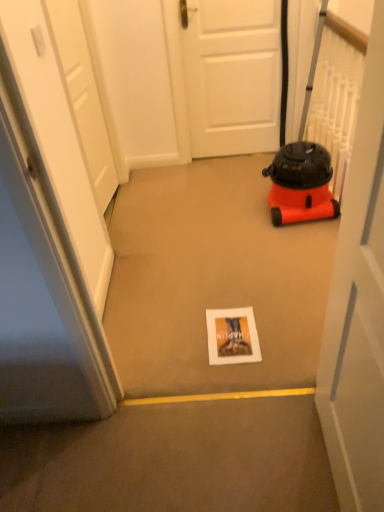
Question: Is white matte door at center, marked as the 3th door in a front-to-back arrangement, located outside white matte door at center, the third door viewed from the left?

Choices:
 (A) no
 (B) yes

Answer: (B)

Question: Is the surface of white matte door at center, the first door in the back-to-front sequence, in direct contact with white matte door at center, marked as the third door in a back-to-front arrangement?

Choices:
 (A) no
 (B) yes

Answer: (A)

Question: Can you confirm if white matte door at center, marked as the 3th door in a front-to-back arrangement, is thinner than white matte door at center, the first door viewed from the front?

Choices:
 (A) yes
 (B) no

Answer: (A)

Question: Can you confirm if white matte door at center, marked as the 3th door in a front-to-back arrangement, is taller than white matte door at center, marked as the third door in a back-to-front arrangement?

Choices:
 (A) yes
 (B) no

Answer: (B)

Question: Considering the relative positions of white matte door at center, the 2th door when ordered from left to right, and white matte door at center, the third door viewed from the left, in the image provided, is white matte door at center, the 2th door when ordered from left to right, to the left of white matte door at center, the third door viewed from the left, from the viewer's perspective?

Choices:
 (A) no
 (B) yes

Answer: (B)

Question: Is white matte door at center, the first door in the back-to-front sequence, to the left or to the right of orange matte vacuum cleaner at right in the image?

Choices:
 (A) left
 (B) right

Answer: (A)

Question: From their relative heights in the image, would you say white matte door at center, the second door from the right, is taller or shorter than orange matte vacuum cleaner at right?

Choices:
 (A) short
 (B) tall

Answer: (A)

Question: From the image's perspective, is white matte door at center, the first door in the back-to-front sequence, located above or below orange matte vacuum cleaner at right?

Choices:
 (A) above
 (B) below

Answer: (A)

Question: From a real-world perspective, is white matte door at center, marked as the 3th door in a front-to-back arrangement, above or below orange matte vacuum cleaner at right?

Choices:
 (A) above
 (B) below

Answer: (B)

Question: In terms of height, does white matte door at center, the third door viewed from the left, look taller or shorter compared to white matte door at upper left, marked as the 2th door in a back-to-front arrangement?

Choices:
 (A) short
 (B) tall

Answer: (A)

Question: In terms of width, does white matte door at center, marked as the third door in a back-to-front arrangement, look wider or thinner when compared to white matte door at upper left, marked as the 2th door in a back-to-front arrangement?

Choices:
 (A) wide
 (B) thin

Answer: (A)

Question: Do you think white matte door at center, the first door viewed from the front, is within white matte door at upper left, the third door positioned from the right, or outside of it?

Choices:
 (A) inside
 (B) outside

Answer: (B)

Question: In terms of size, does white matte door at center, acting as the 1th door starting from the right, appear bigger or smaller than white matte door at upper left, marked as the 2th door in a back-to-front arrangement?

Choices:
 (A) big
 (B) small

Answer: (A)

Question: In terms of height, does white matte door at center, marked as the third door in a back-to-front arrangement, look taller or shorter compared to matte paper postcard at center?

Choices:
 (A) short
 (B) tall

Answer: (B)

Question: Visually, is white matte door at center, acting as the 1th door starting from the right, positioned to the left or to the right of matte paper postcard at center?

Choices:
 (A) left
 (B) right

Answer: (B)